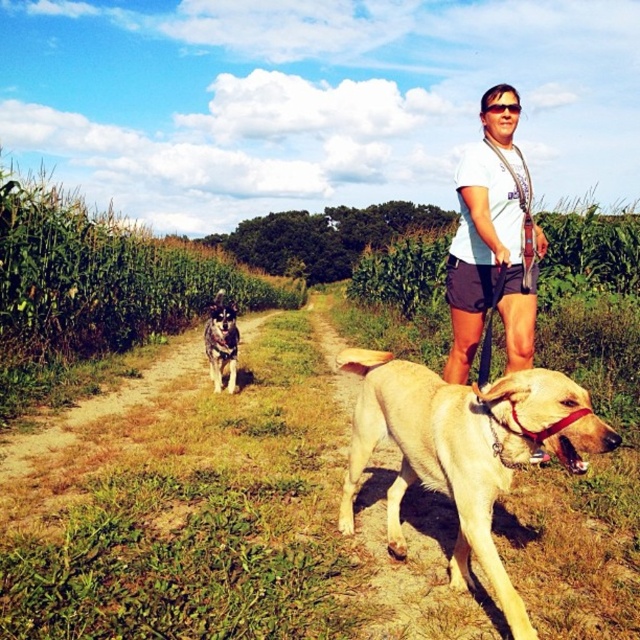
You are a drone operator trying to capture a photo of the golden fur dog at center and the gray fur dog at left in the same frame. The camera has a maximum focus range of 5 meters. Will both dogs be in focus if you position the camera equidistant from both dogs?

The golden fur dog at center and gray fur dog at left are 4.77 meters apart. Since the camera is positioned equidistant between them, each dog would be 2.385 meters away from the camera. As the maximum focus range is 5 meters, both dogs are within the focus range and will be in focus.